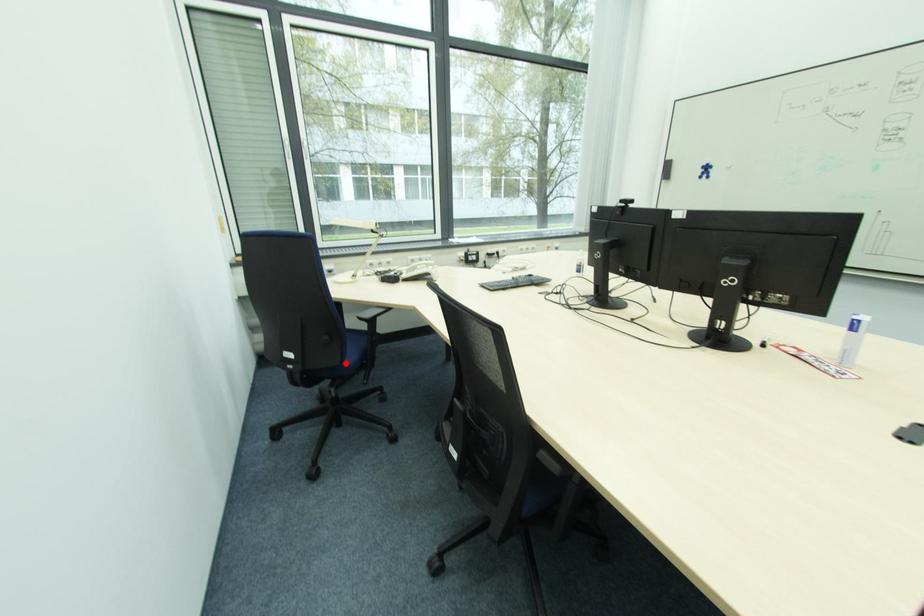
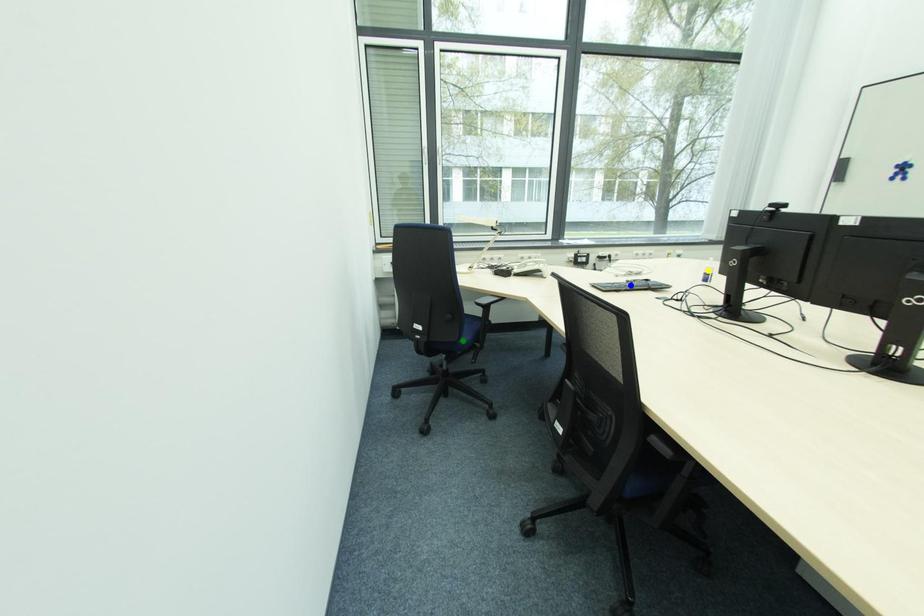
Question: I am providing you with two images of the same scene from different viewpoints. A red point is marked on the first image. You are given multiple points on the second image. Can you choose the point in image 2 that corresponds to the point in image 1?

Choices:
 (A) yellow point
 (B) blue point
 (C) green point

Answer: (C)